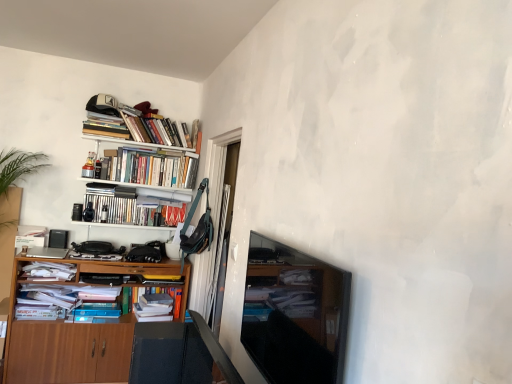
Question: Is wooden cabinet at left inside the boundaries of hardcover books at upper left, marked as the 4th book in a top-to-bottom arrangement, or outside?

Choices:
 (A) inside
 (B) outside

Answer: (B)

Question: Is point (34, 347) closer or farther from the camera than point (143, 211)?

Choices:
 (A) closer
 (B) farther

Answer: (A)

Question: Which is farther from the hardcover books at upper left, which is counted as the fifth book, starting from the bottom?

Choices:
 (A) hardcover books at upper left, marked as the third book in a top-to-bottom arrangement
 (B) transparent glass door at center
 (C) hardcover books at upper left, which is the 2th book from bottom to top
 (D) white matte bookshelf at upper left
 (E) wooden cabinet at left

Answer: (E)

Question: Which is farther from the matte black tv at center?

Choices:
 (A) hardcover books at upper left, which is the 2th book from bottom to top
 (B) hardcover books at upper left, the first book when ordered from top to bottom
 (C) white matte bookshelf at upper left
 (D) wooden cabinet at left
 (E) transparent glass door at center

Answer: (B)